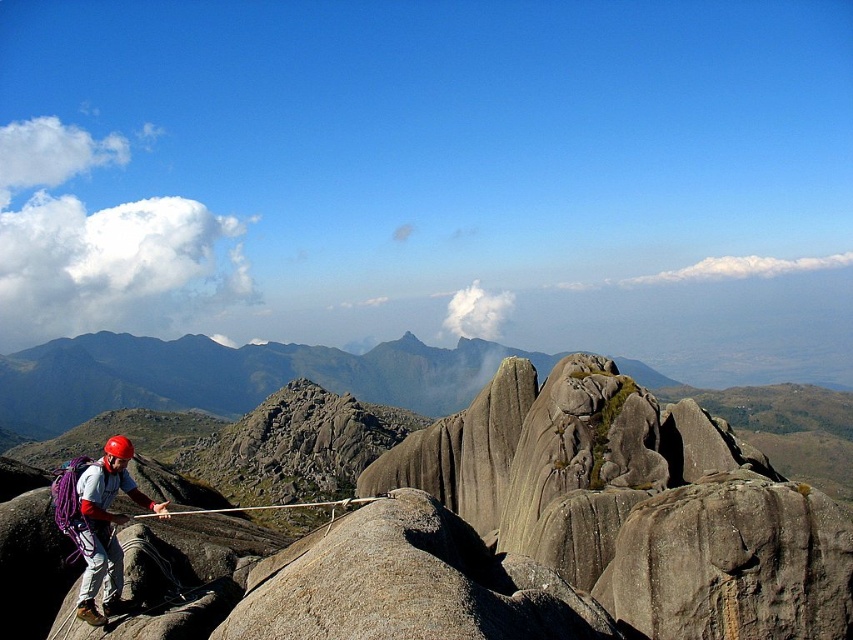
Looking at this image, you are a mountain climber planning to move from the point at coordinates point (171, 353) to the point at coordinates point (107, 528). Given that you want to descend towards the nearest visible terrain, which direction should you go relative to these two points?

Since point (171, 353) is closer to the viewer than point (107, 528), descending towards point (107, 528) would mean moving away from the viewer. Therefore, to descend towards the nearest terrain, you should move towards point (107, 528) as it is farther away and likely lower in elevation.

You are a mountain guide assessing the climbing route. You notice the gray rock formation at center and the matte gray helmet at left. Which object is higher up the mountain?

The gray rock formation at center is much taller than the matte gray helmet at left, so the gray rock formation at center is higher up the mountain.